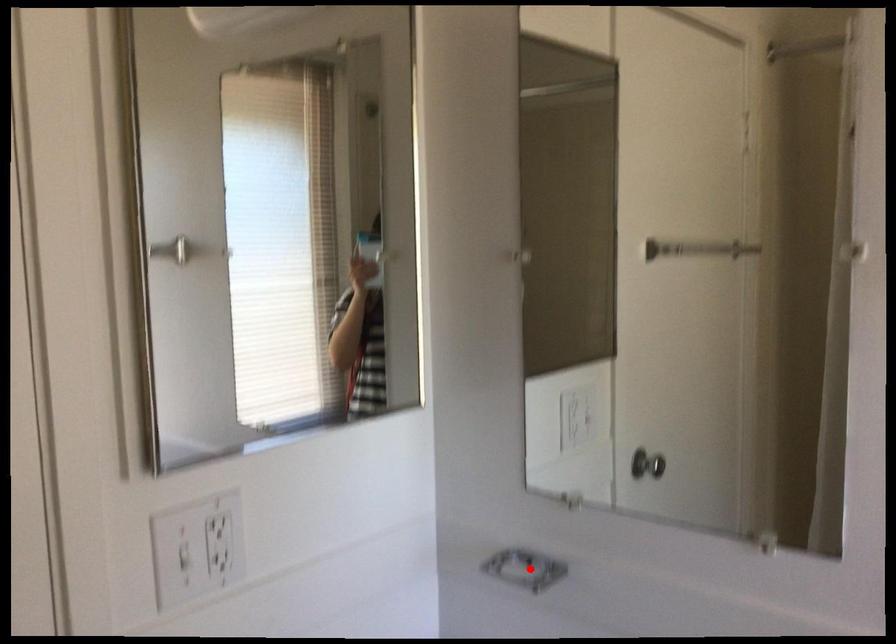
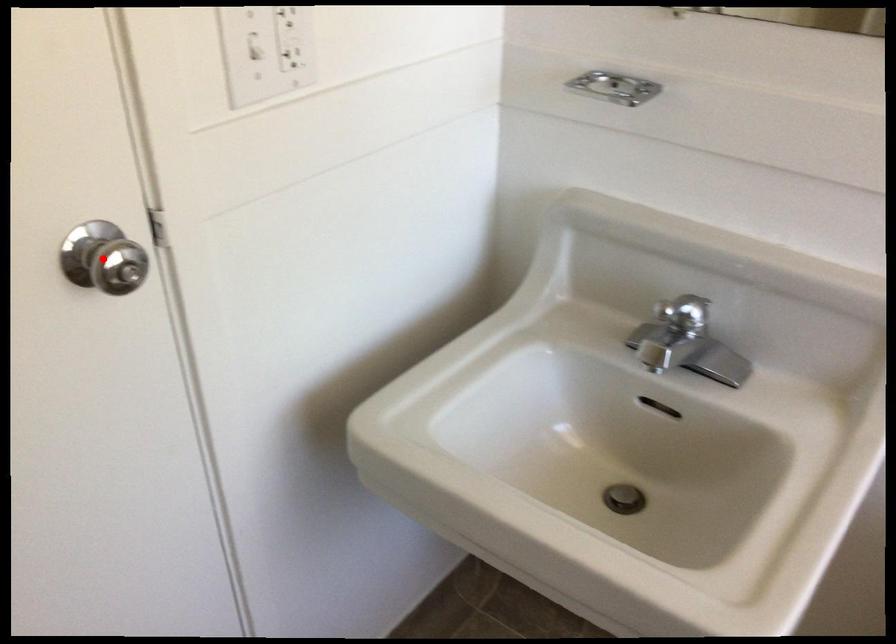
From the picture: I am providing you with two images of the same scene from different viewpoints. A red point is marked on the first image and another point is marked on the second image. Are the points marked in image1 and image2 representing the same 3D position?

No